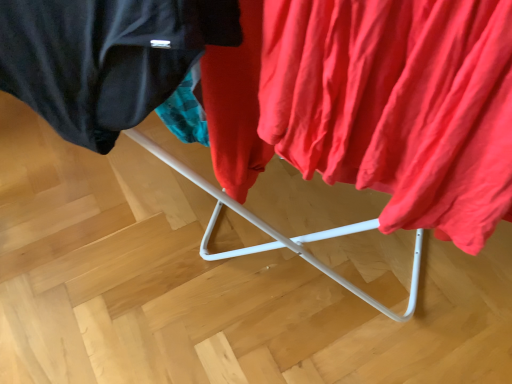
This screenshot has height=384, width=512. Describe the element at coordinates (373, 105) in the screenshot. I see `matte red fabric at right` at that location.

Where is `matte red fabric at right`? This screenshot has width=512, height=384. matte red fabric at right is located at coordinates (373, 105).

What do you see at coordinates (105, 58) in the screenshot? I see `matte black jacket at upper left` at bounding box center [105, 58].

Measure the distance between matte black jacket at upper left and camera.

matte black jacket at upper left and camera are 33.65 centimeters apart from each other.

Where is `matte black jacket at upper left`? The height and width of the screenshot is (384, 512). matte black jacket at upper left is located at coordinates (105, 58).

This screenshot has height=384, width=512. I want to click on matte red fabric at right, so click(373, 105).

Would you say matte black jacket at upper left is to the left or to the right of matte red fabric at right in the picture?

matte black jacket at upper left is to the left of matte red fabric at right.

Is matte black jacket at upper left closer to the viewer compared to matte red fabric at right?

No, the depth of matte black jacket at upper left is greater than that of matte red fabric at right.

Between point (125, 97) and point (315, 118), which one is positioned in front?

The point (315, 118) is closer.

From the image's perspective, is matte black jacket at upper left on matte red fabric at right?

Yes, from the image's perspective, matte black jacket at upper left is above matte red fabric at right.

Consider the image. From a real-world perspective, which object rests below the other?

From a 3D spatial view, matte black jacket at upper left is below.

Does matte black jacket at upper left have a lesser width compared to matte red fabric at right?

Indeed, matte black jacket at upper left has a lesser width compared to matte red fabric at right.

Between matte black jacket at upper left and matte red fabric at right, which one has less height?

matte black jacket at upper left is shorter.

Who is smaller, matte black jacket at upper left or matte red fabric at right?

matte black jacket at upper left is smaller.

Is matte black jacket at upper left located outside matte red fabric at right?

Yes, matte black jacket at upper left is not within matte red fabric at right.

Is matte black jacket at upper left far from matte red fabric at right?

No, matte black jacket at upper left is not far away from matte red fabric at right.

From the picture: Is matte black jacket at upper left positioned with its back to matte red fabric at right?

No, matte black jacket at upper left's orientation is not away from matte red fabric at right.

Can you tell me how much matte black jacket at upper left and matte red fabric at right differ in facing direction?

There is a 3-degree angle between the facing directions of matte black jacket at upper left and matte red fabric at right.

How much distance is there between matte black jacket at upper left and matte red fabric at right?

matte black jacket at upper left and matte red fabric at right are 6.14 inches apart.

Locate an element on the screen. The image size is (512, 384). curtain located in front of the matte black jacket at upper left is located at coordinates (373, 105).

Is matte red fabric at right at the right side of matte black jacket at upper left?

Indeed, matte red fabric at right is positioned on the right side of matte black jacket at upper left.

Which is in front, matte red fabric at right or matte black jacket at upper left?

matte red fabric at right.

Which point is more forward, (389, 32) or (164, 10)?

Point (389, 32)

Looking at this image, from the image's perspective, does matte red fabric at right appear higher than matte black jacket at upper left?

Incorrect, from the image's perspective, matte red fabric at right is lower than matte black jacket at upper left.

From a real-world perspective, between matte red fabric at right and matte black jacket at upper left, who is vertically lower?

matte black jacket at upper left.

Considering the sizes of objects matte red fabric at right and matte black jacket at upper left in the image provided, who is thinner, matte red fabric at right or matte black jacket at upper left?

matte black jacket at upper left.

Which of these two, matte red fabric at right or matte black jacket at upper left, stands shorter?

With less height is matte black jacket at upper left.

Is matte red fabric at right smaller than matte black jacket at upper left?

No, matte red fabric at right is not smaller than matte black jacket at upper left.

Would you say matte black jacket at upper left is part of matte red fabric at right's contents?

No.

Can you see matte red fabric at right touching matte black jacket at upper left?

matte red fabric at right is not next to matte black jacket at upper left, and they're not touching.

Is matte black jacket at upper left at the back of matte red fabric at right?

matte red fabric at right does not have its back to matte black jacket at upper left.

Where is `curtain above the matte black jacket at upper left (from a real-world perspective)`? The image size is (512, 384). curtain above the matte black jacket at upper left (from a real-world perspective) is located at coordinates (373, 105).

Where is `curtain that is above the matte black jacket at upper left (from a real-world perspective)`? Image resolution: width=512 pixels, height=384 pixels. curtain that is above the matte black jacket at upper left (from a real-world perspective) is located at coordinates (373, 105).

The height and width of the screenshot is (384, 512). Find the location of `cloak located underneath the matte red fabric at right (from a real-world perspective)`. cloak located underneath the matte red fabric at right (from a real-world perspective) is located at coordinates (105, 58).